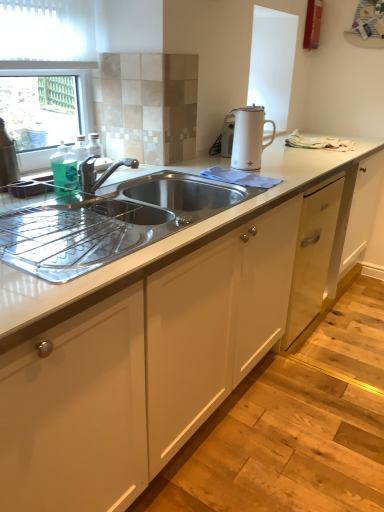
Identify the location of stainless steel sink at center. (109, 222).

Measure the distance between point (160, 196) and camera.

Point (160, 196) and camera are 5.60 feet apart from each other.

What do you see at coordinates (109, 222) in the screenshot? I see `stainless steel sink at center` at bounding box center [109, 222].

Describe the element at coordinates (249, 137) in the screenshot. I see `white glossy electric kettle at upper right` at that location.

I want to click on white glossy electric kettle at upper right, so click(249, 137).

The height and width of the screenshot is (512, 384). Identify the location of stainless steel sink at center. (109, 222).

Considering the positions of objects stainless steel sink at center and white glossy electric kettle at upper right in the image provided, who is more to the right, stainless steel sink at center or white glossy electric kettle at upper right?

white glossy electric kettle at upper right is more to the right.

Considering the positions of objects stainless steel sink at center and white glossy electric kettle at upper right in the image provided, who is in front, stainless steel sink at center or white glossy electric kettle at upper right?

stainless steel sink at center is closer to the camera.

Is point (175, 189) farther from camera compared to point (237, 108)?

No, (175, 189) is closer to viewer.

In the scene shown: From the image's perspective, is stainless steel sink at center on top of white glossy electric kettle at upper right?

Incorrect, from the image's perspective, stainless steel sink at center is lower than white glossy electric kettle at upper right.

From a real-world perspective, is stainless steel sink at center located beneath white glossy electric kettle at upper right?

Yes.

Is stainless steel sink at center thinner than white glossy electric kettle at upper right?

No.

Can you confirm if stainless steel sink at center is taller than white glossy electric kettle at upper right?

In fact, stainless steel sink at center may be shorter than white glossy electric kettle at upper right.

Considering the sizes of objects stainless steel sink at center and white glossy electric kettle at upper right in the image provided, who is bigger, stainless steel sink at center or white glossy electric kettle at upper right?

Bigger between the two is stainless steel sink at center.

Based on the photo, is white glossy electric kettle at upper right surrounded by stainless steel sink at center?

No.

Does stainless steel sink at center touch white glossy electric kettle at upper right?

No, stainless steel sink at center is not with white glossy electric kettle at upper right.

Is stainless steel sink at center positioned with its back to white glossy electric kettle at upper right?

No, stainless steel sink at center's orientation is not away from white glossy electric kettle at upper right.

Locate an element on the screen. The image size is (384, 512). home appliance lying behind the stainless steel sink at center is located at coordinates (249, 137).

Between white glossy electric kettle at upper right and stainless steel sink at center, which one appears on the left side from the viewer's perspective?

stainless steel sink at center.

Is white glossy electric kettle at upper right closer to camera compared to stainless steel sink at center?

No, white glossy electric kettle at upper right is behind stainless steel sink at center.

Considering the positions of points (245, 115) and (248, 189), is point (245, 115) closer to camera compared to point (248, 189)?

No, (245, 115) is behind (248, 189).

From the image's perspective, which object appears higher, white glossy electric kettle at upper right or stainless steel sink at center?

From the image's view, white glossy electric kettle at upper right is above.

From a real-world perspective, is white glossy electric kettle at upper right physically below stainless steel sink at center?

No, from a real-world perspective, white glossy electric kettle at upper right is not below stainless steel sink at center.

Considering the sizes of objects white glossy electric kettle at upper right and stainless steel sink at center in the image provided, who is thinner, white glossy electric kettle at upper right or stainless steel sink at center?

Thinner between the two is white glossy electric kettle at upper right.

Can you confirm if white glossy electric kettle at upper right is taller than stainless steel sink at center?

Yes, white glossy electric kettle at upper right is taller than stainless steel sink at center.

Between white glossy electric kettle at upper right and stainless steel sink at center, which one has larger size?

stainless steel sink at center.

From the picture: Is white glossy electric kettle at upper right not within stainless steel sink at center?

Indeed, white glossy electric kettle at upper right is completely outside stainless steel sink at center.

Is white glossy electric kettle at upper right positioned far away from stainless steel sink at center?

No, white glossy electric kettle at upper right is not far away from stainless steel sink at center.

Is white glossy electric kettle at upper right turned away from stainless steel sink at center?

No, white glossy electric kettle at upper right is not facing the opposite direction of stainless steel sink at center.

How much distance is there between white glossy electric kettle at upper right and stainless steel sink at center?

They are 24.76 inches apart.

Locate an element on the screen. The image size is (384, 512). home appliance on the right of stainless steel sink at center is located at coordinates (249, 137).

I want to click on home appliance behind the stainless steel sink at center, so click(249, 137).

I want to click on sink directly beneath the white glossy electric kettle at upper right (from a real-world perspective), so click(109, 222).